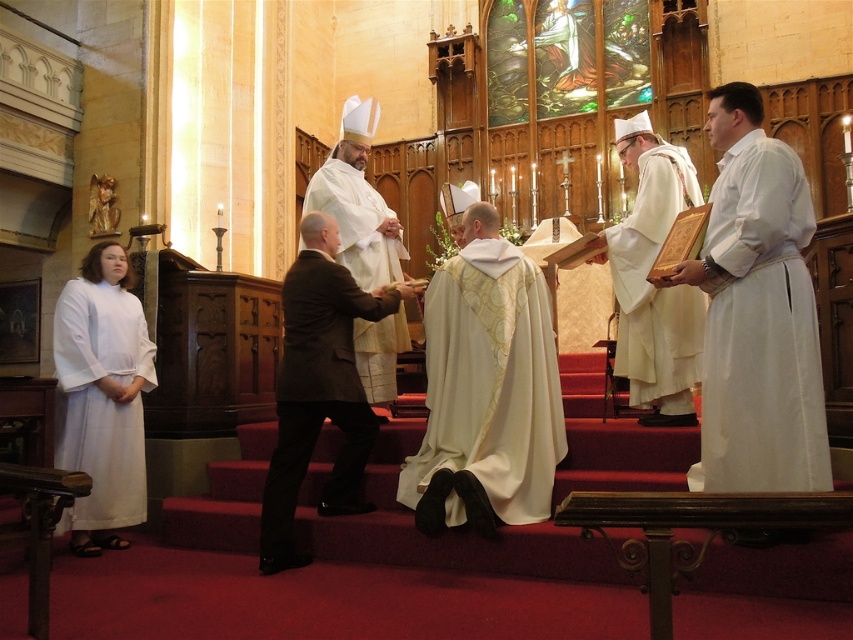
You are attending the ceremony and need to determine which robe is more prominent in height between the white silk robe at center and the white textured robe at center. Based on the scene, which one is taller?

The white silk robe at center is much taller than the white textured robe at center, making it the more prominent one in height.

You are standing in the church and want to take a photo of both point (350, 445) and point (360, 372). Which point should you focus on first to ensure both are in focus?

Point (350, 445) is closer to the camera than point (360, 372). To ensure both are in focus, focus on the closer point (350, 445) first.